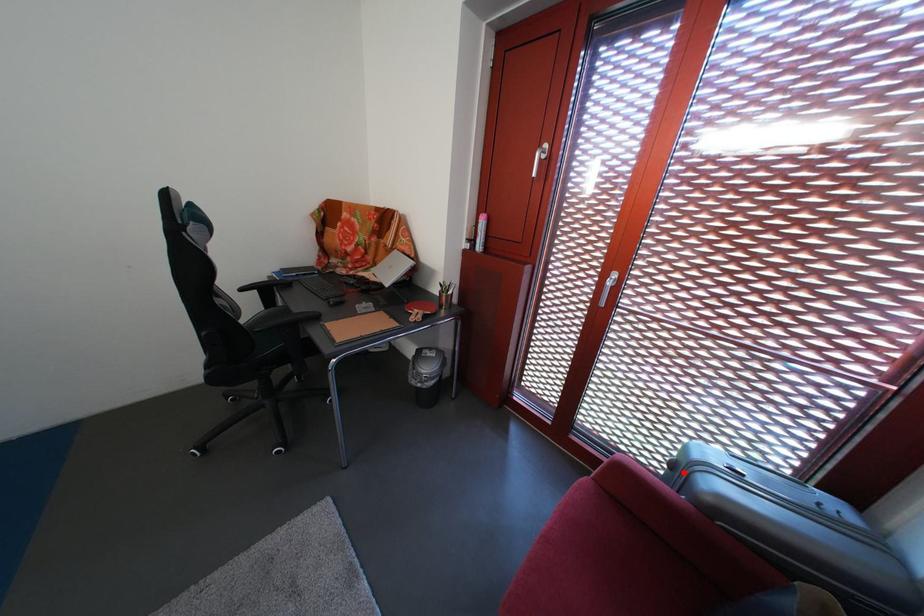
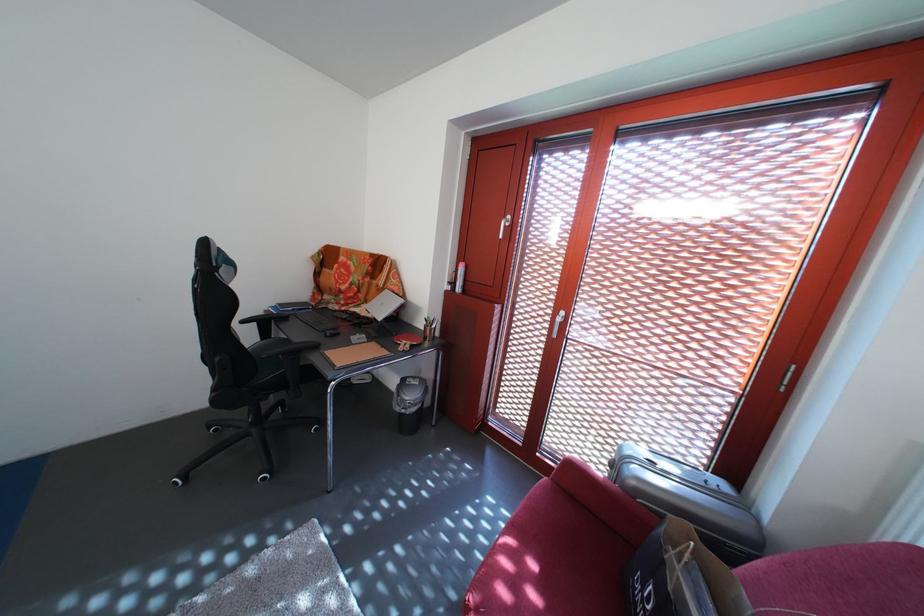
The point at the highlighted location is marked in the first image. Where is the corresponding point in the second image?

(623, 471)